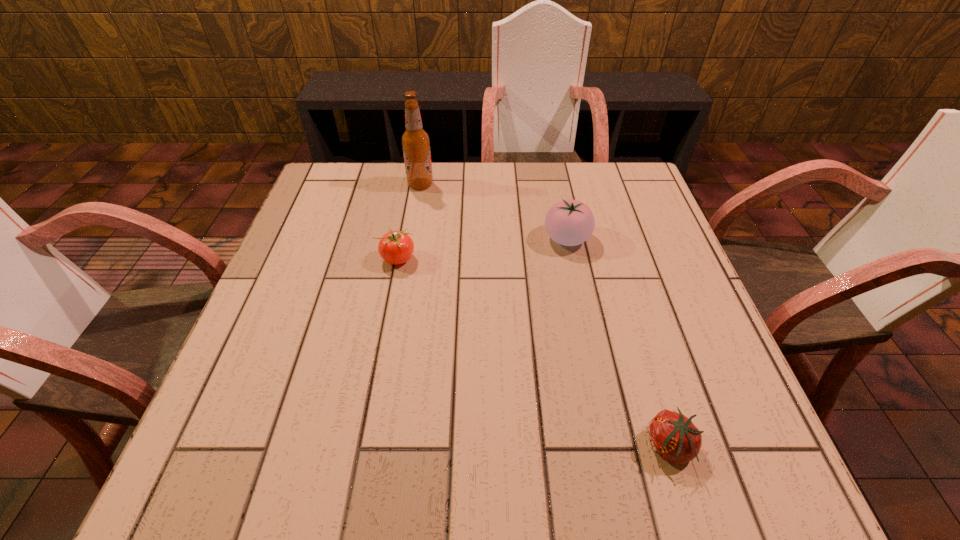
Image resolution: width=960 pixels, height=540 pixels. I want to click on vacant region that satisfies the following two spatial constraints: 1. on the front label of the farthest object; 2. on the right side of the tallest tomato, so click(412, 239).